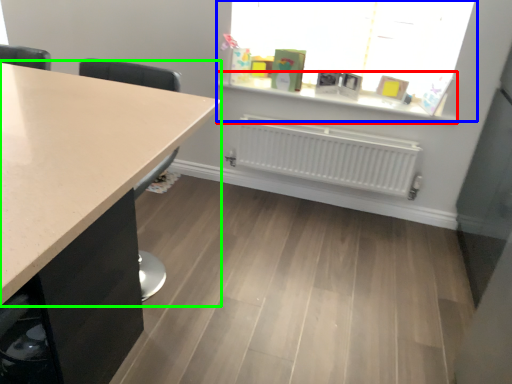
Question: Which is nearer to the window sill (highlighted by a red box)? window (highlighted by a blue box) or countertop (highlighted by a green box).

Choices:
 (A) window
 (B) countertop

Answer: (A)